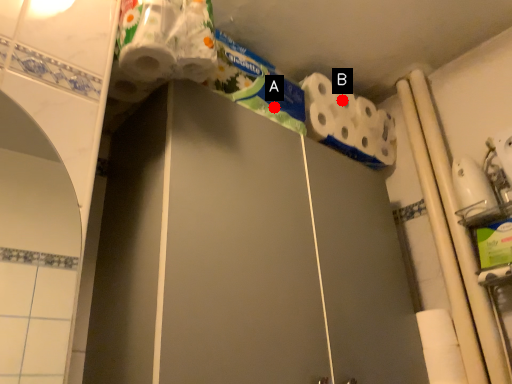
Question: Two points are circled on the image, labeled by A and B beside each circle. Which point is farther from the camera taking this photo?

Choices:
 (A) A is further
 (B) B is further

Answer: (B)